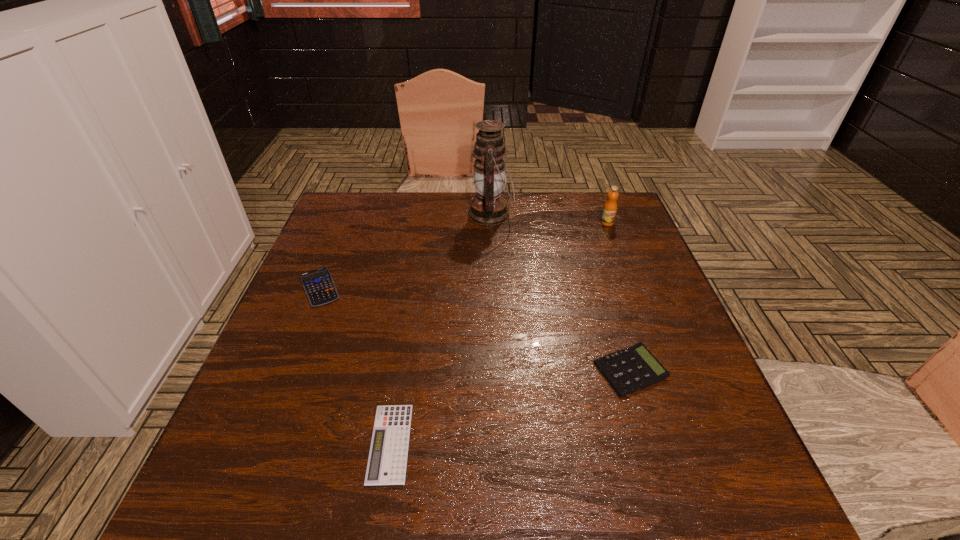
Identify the location of vacant space that satisfies the following two spatial constraints: 1. on the back side of the rightmost calculator; 2. on the right side of the second calculator from left to right. (402, 370).